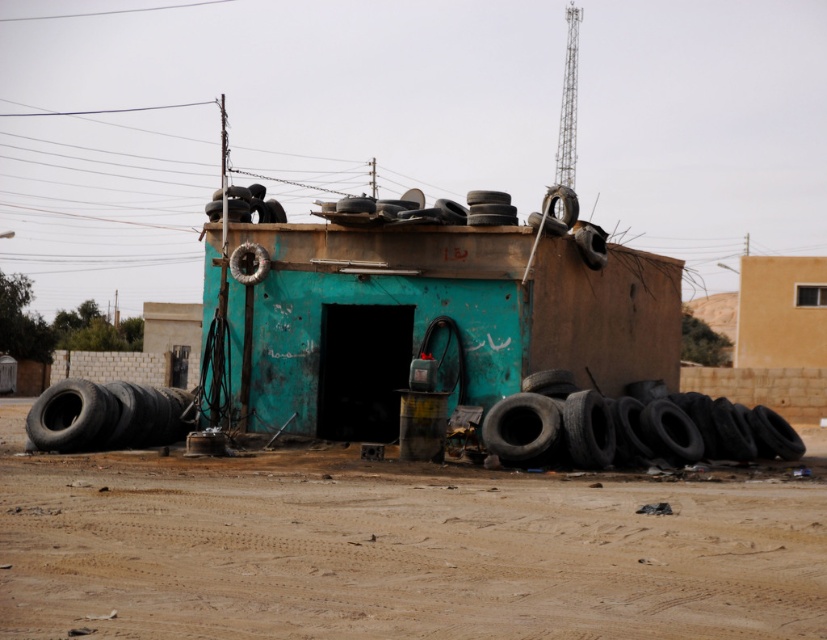
Question: Does teal matte hut at center appear on the right side of beige stucco wall at upper right?

Choices:
 (A) no
 (B) yes

Answer: (A)

Question: Which point appears farthest from the camera in this image?

Choices:
 (A) (682, 422)
 (B) (555, 186)

Answer: (B)

Question: Which object is positioned closest to the black rubber tire at lower left?

Choices:
 (A) beige stucco wall at upper right
 (B) black rubber tire at upper right

Answer: (B)

Question: Is teal matte hut at center bigger than black rubber tires at lower right?

Choices:
 (A) no
 (B) yes

Answer: (B)

Question: Does teal matte hut at center come behind black rubber tire at lower left?

Choices:
 (A) yes
 (B) no

Answer: (A)

Question: Which point is closer to the camera?

Choices:
 (A) (41, 440)
 (B) (246, 193)
 (C) (139, 556)
 (D) (552, 216)

Answer: (C)